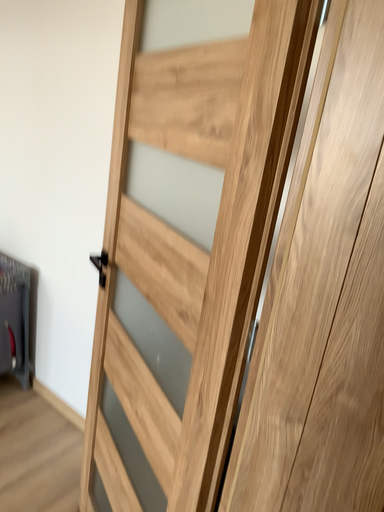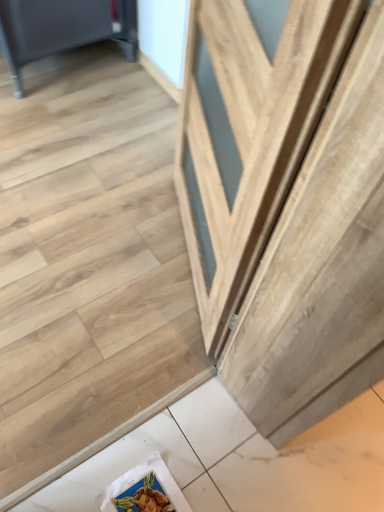
Question: How did the camera likely rotate when shooting the video?

Choices:
 (A) rotated downward
 (B) rotated upward

Answer: (A)